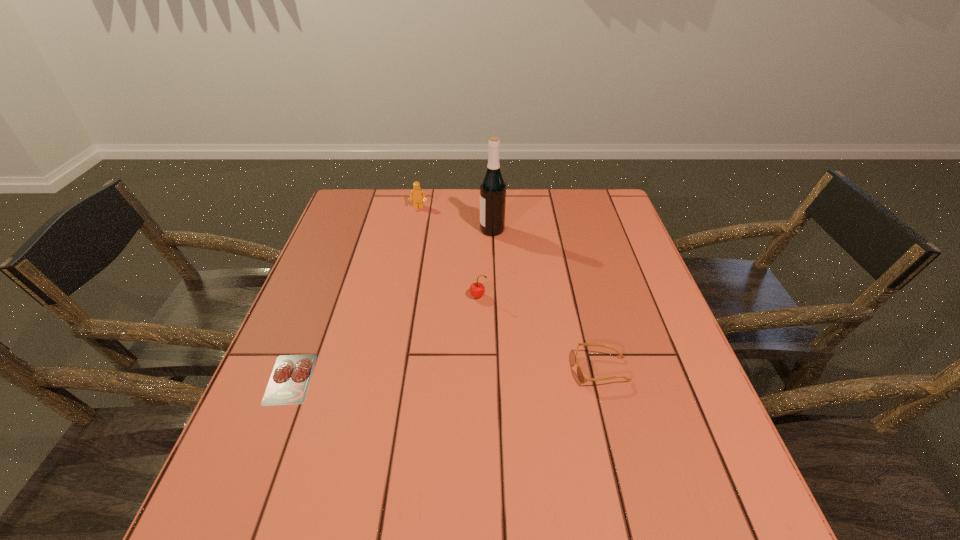
The image size is (960, 540). In order to click on empty space between the cherry and the rightmost object in this screenshot , I will do `click(540, 333)`.

Locate an element on the screen. Image resolution: width=960 pixels, height=540 pixels. unoccupied area between the fourth nearest object and the shortest object is located at coordinates (392, 304).

Locate an element on the screen. Image resolution: width=960 pixels, height=540 pixels. unoccupied area between the shortest object and the sunglasses is located at coordinates (445, 374).

Where is `vacant area between the salami and the third nearest object`? The image size is (960, 540). vacant area between the salami and the third nearest object is located at coordinates (384, 338).

This screenshot has width=960, height=540. Identify the location of empty location between the sunglasses and the shortest object. (445, 374).

Where is `vacant area between the farthest object and the third nearest object`? The image size is (960, 540). vacant area between the farthest object and the third nearest object is located at coordinates (448, 252).

This screenshot has height=540, width=960. Identify the location of empty location between the second farthest object and the third farthest object. (485, 263).

Identify the location of object that is the closest one to the third farthest object. (493, 187).

Where is `object that stands as the second closest to the shortest object`? The height and width of the screenshot is (540, 960). object that stands as the second closest to the shortest object is located at coordinates (582, 378).